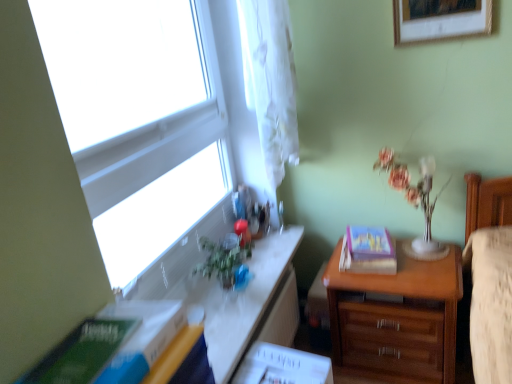
At what (x,y) coordinates should I click in order to perform the action: click on free space between hardcover book at right, which is the second paperback book in front-to-back order, and translucent glass vase at upper right. Please return your answer as a coordinate pair (x, y). This screenshot has width=512, height=384. Looking at the image, I should click on (421, 259).